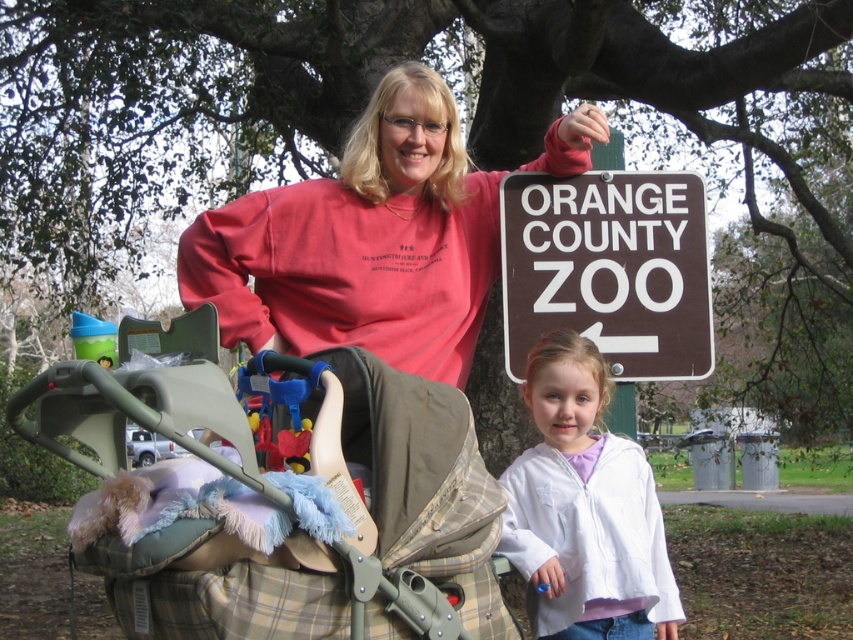
Looking at this image, you are standing at the entrance of the Orange County Zoo and see two points marked in the image. The first point is at coordinates point (440,493) and the second is at point (328,234). Which point is closer to you?

Point (440,493) is in front of point (328,234), so the first point is closer to you.

You are a photographer trying to capture the plaid fabric baby carriage at center and the matte pink sweatshirt at center in a single shot. Which object should you focus on first to ensure both are in focus?

The plaid fabric baby carriage at center is closer to the viewer than the matte pink sweatshirt at center. To ensure both are in focus, you should focus on the plaid fabric baby carriage at center first.